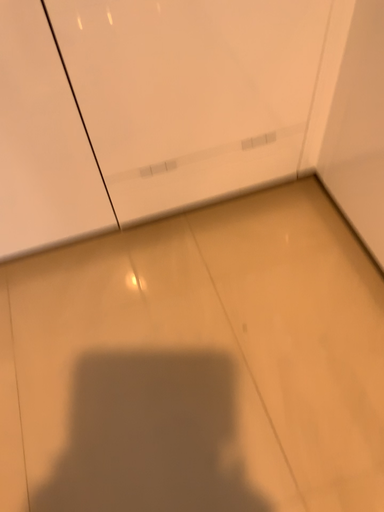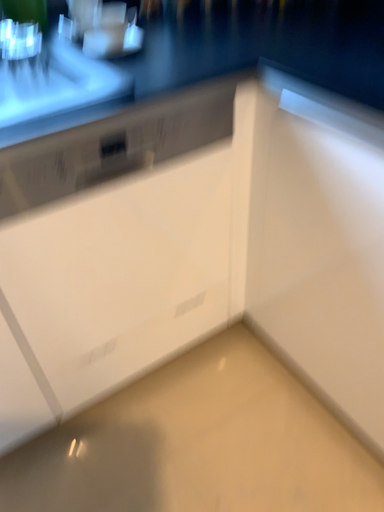
Question: Which way did the camera rotate in the video?

Choices:
 (A) rotated downward
 (B) rotated upward

Answer: (B)